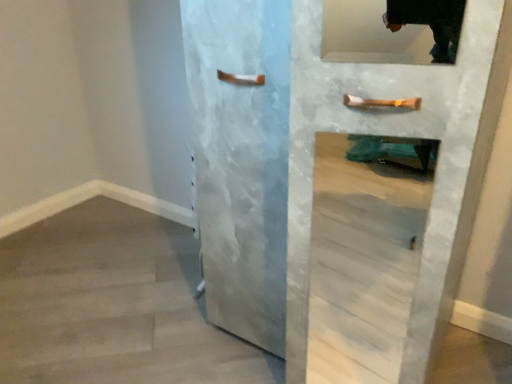
Where is `free space behind matte white cabinet at center`? Image resolution: width=512 pixels, height=384 pixels. free space behind matte white cabinet at center is located at coordinates (331, 250).